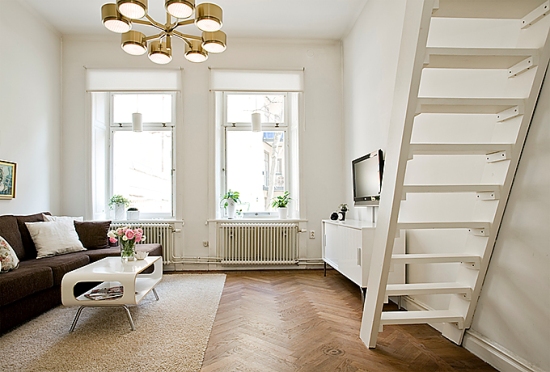
Identify the location of coffee table. (126, 270).